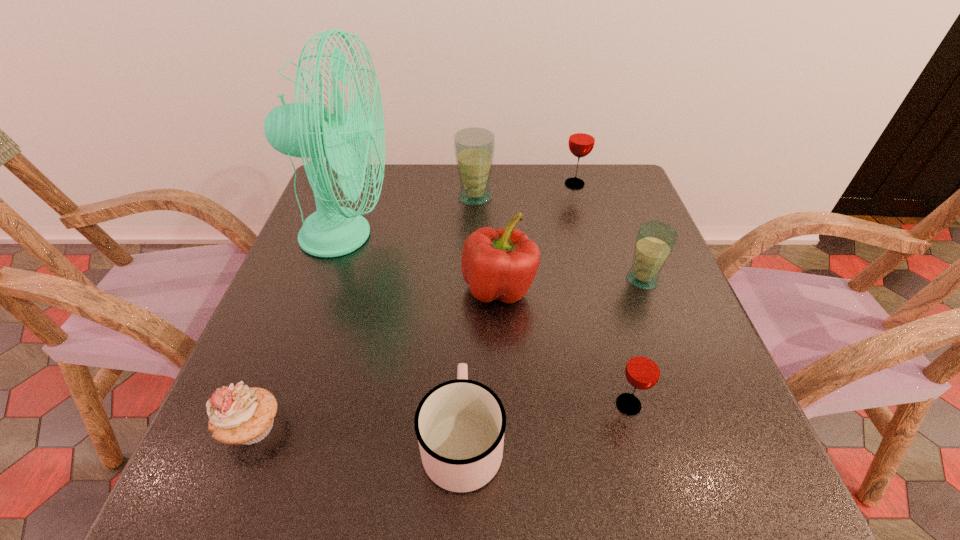
Image resolution: width=960 pixels, height=540 pixels. Identify the location of free space at the far edge of the desktop. (401, 189).

In the image, there is a desktop. Where is `vacant space at the near edge`? Image resolution: width=960 pixels, height=540 pixels. vacant space at the near edge is located at coordinates (308, 476).

This screenshot has width=960, height=540. Identify the location of vacant space at the left edge of the desktop. (239, 367).

What are the coordinates of `vacant space at the right edge of the desktop` in the screenshot? It's located at (654, 307).

You are a GUI agent. You are given a task and a screenshot of the screen. Output one action in this format:
    pyautogui.click(x=<x>, y=<y>)
    Task: Click on the vacant area at the near right corner of the desktop
    This screenshot has height=540, width=960.
    Given the screenshot: What is the action you would take?
    click(708, 478)

This screenshot has height=540, width=960. I want to click on vacant region between the bigger red glass and the fan, so click(x=461, y=210).

The image size is (960, 540). Find the location of `unoccupied position between the bigger blue glass and the nearer red glass`. unoccupied position between the bigger blue glass and the nearer red glass is located at coordinates (552, 301).

You are a GUI agent. You are given a task and a screenshot of the screen. Output one action in this format:
    pyautogui.click(x=<x>, y=<y>)
    Task: Click on the empty space that is in between the farther red glass and the right blue glass
    
    Given the screenshot: What is the action you would take?
    pyautogui.click(x=609, y=232)

Locate an element on the screen. This screenshot has width=960, height=540. vacant point located between the smaller red glass and the farther blue glass is located at coordinates (552, 301).

You are a GUI agent. You are given a task and a screenshot of the screen. Output one action in this format:
    pyautogui.click(x=<x>, y=<y>)
    Task: Click on the vacant area that lies between the fan and the nearer red glass
    The image size is (960, 540).
    Given the screenshot: What is the action you would take?
    pyautogui.click(x=488, y=320)